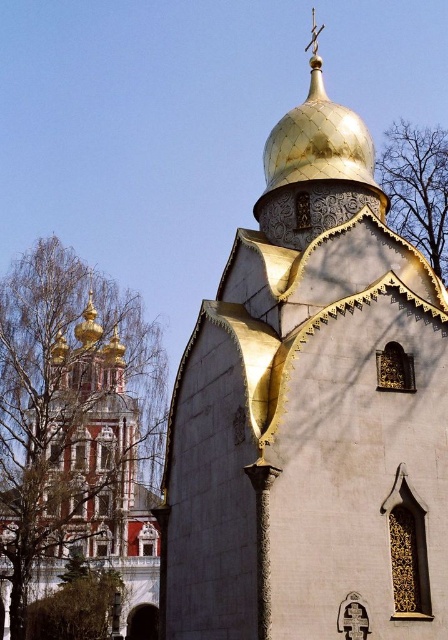
Describe the element at coordinates (311, 413) in the screenshot. The image size is (448, 640). I see `gold textured dome at center` at that location.

Does point (203, 305) lie in front of point (136, 538)?

That is True.

Image resolution: width=448 pixels, height=640 pixels. I want to click on gold textured dome at center, so click(x=311, y=413).